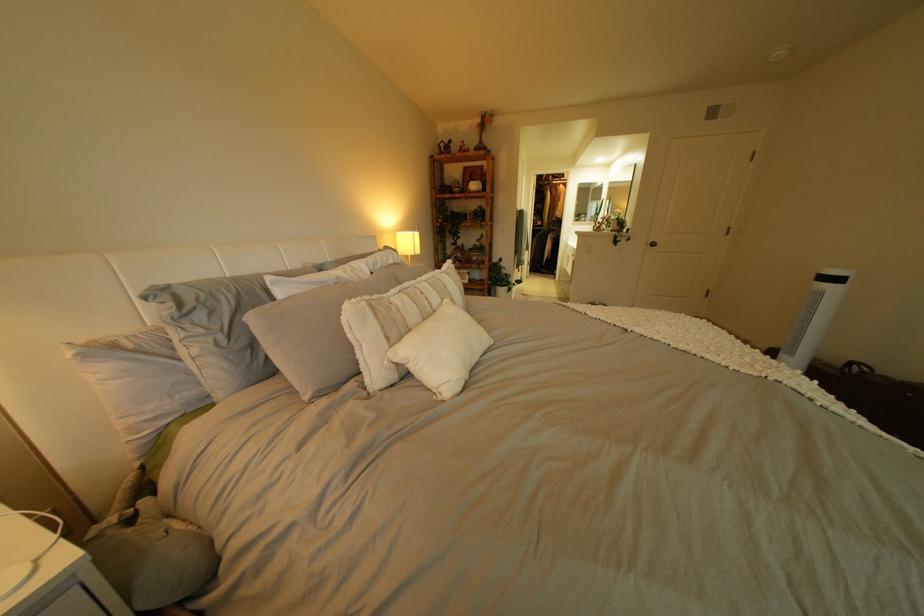
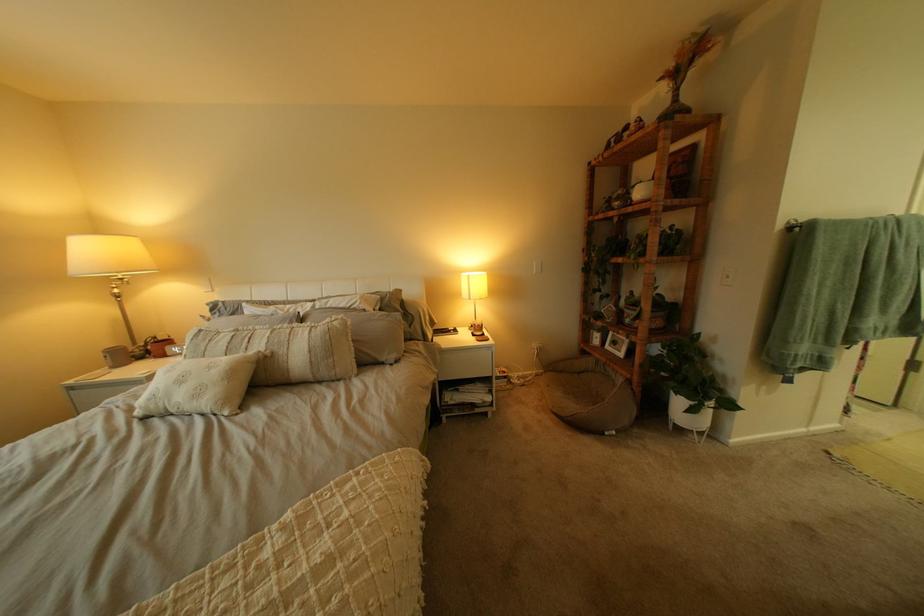
In the second image, find the point that corresponds to the point at 451,294 in the first image.

(281, 342)